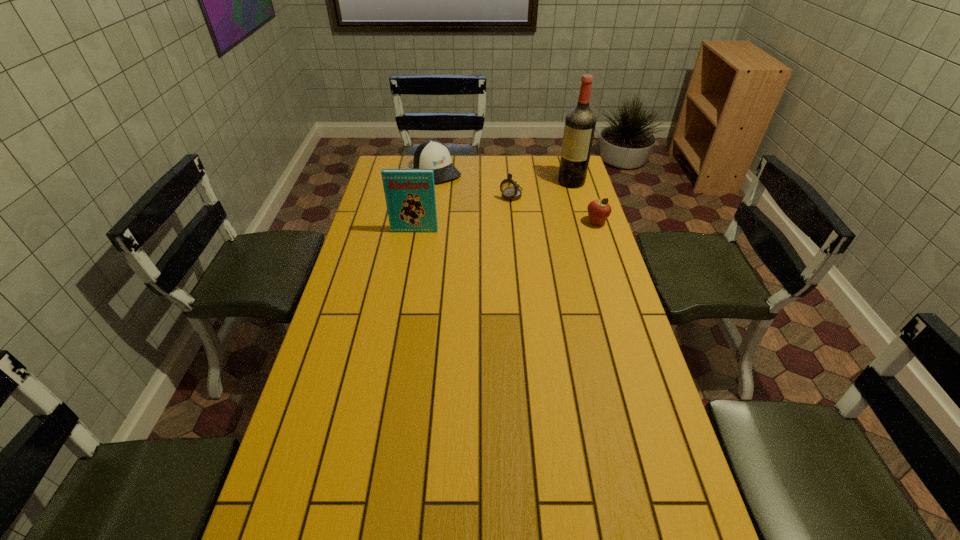
The image size is (960, 540). I want to click on free location that satisfies the following two spatial constraints: 1. on the front side of the apple; 2. on the left side of the cap, so click(x=430, y=223).